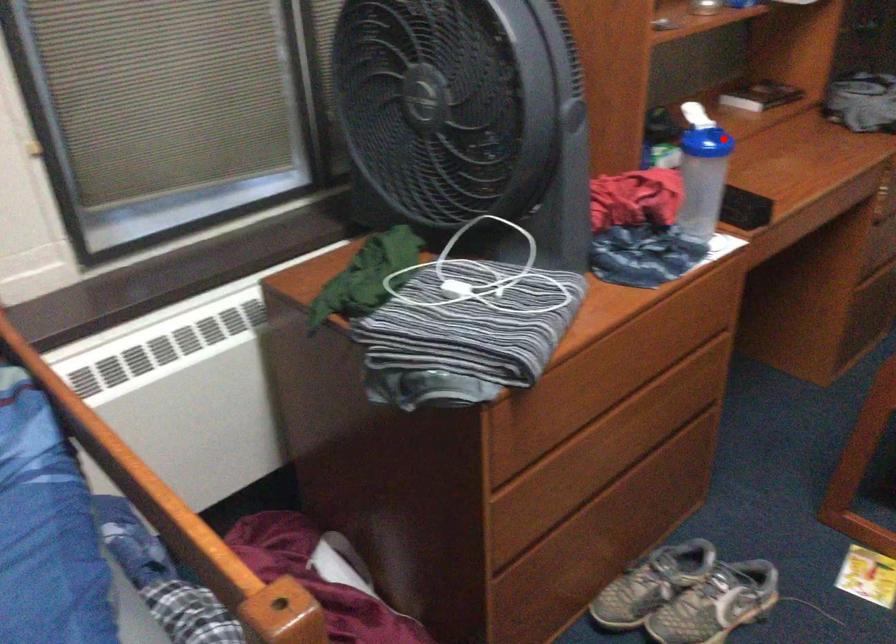
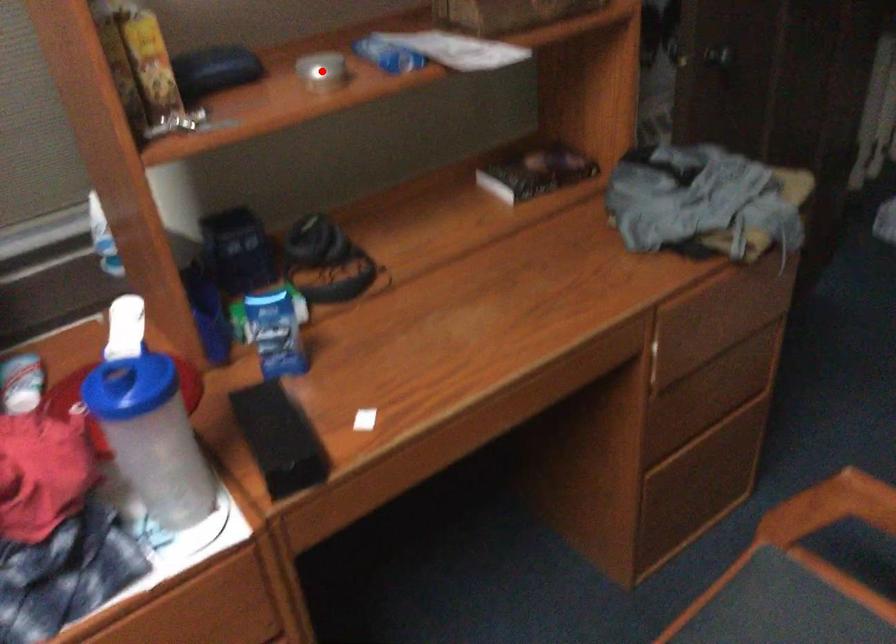
I am providing you with two images of the same scene from different viewpoints. A red point is marked on the first image and another point is marked on the second image. Is the marked point in image1 the same physical position as the marked point in image2?

No